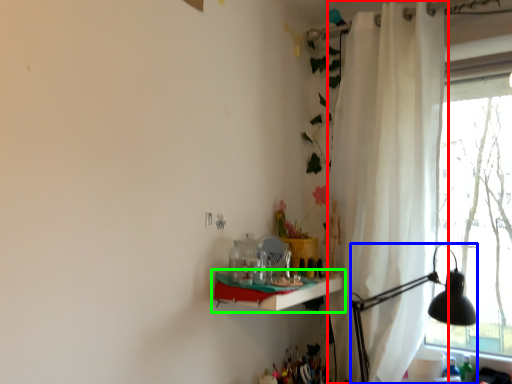
Question: Estimate the real-world distances between objects in this image. Which object is closer to curtain (highlighted by a red box), table lamp (highlighted by a blue box) or shelf (highlighted by a green box)?

Choices:
 (A) table lamp
 (B) shelf

Answer: (A)